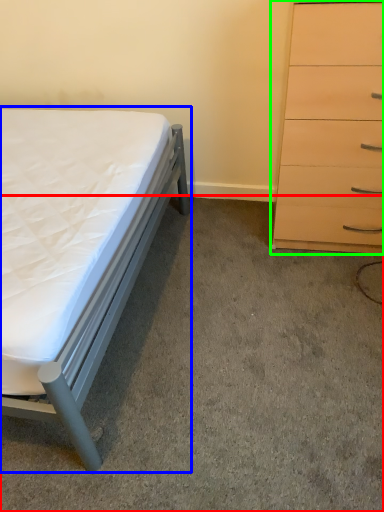
Question: Which object is the farthest from concrete (highlighted by a red box)? Choose among these: bed (highlighted by a blue box) or chest of drawers (highlighted by a green box).

Choices:
 (A) bed
 (B) chest of drawers

Answer: (B)